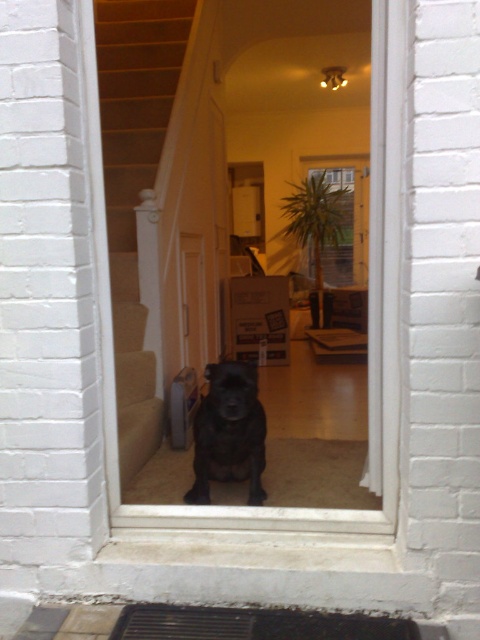
Looking at this image, you are standing outside the house looking through the slightly open doorway. You see the carpeted stairs at center and the shiny black dog at center. Which object is closer to you from your current position?

The shiny black dog at center is closer to you because the carpeted stairs at center is positioned over it, meaning the dog is beneath the stairs in the depth of the room.

You are a delivery person holding a 1.2 meter long package. You need to go through the doorway into the house to deliver it. The package must be carried horizontally. Is there enough space between the shiny black dog at center and the carpeted stairs at center to maneuver the package without hitting either?

The distance between the shiny black dog at center and the carpeted stairs at center is 82.07 centimeters. Since the package is 1.2 meters long, which is longer than the available space, you cannot maneuver the package horizontally between them without hitting either object.

You are a delivery person entering the house through the doorway. You see the dark brown textured mat at lower center and the shiny black dog at center. Which object is located closer to the entrance?

The dark brown textured mat at lower center is positioned under the shiny black dog at center, meaning the mat is closer to the entrance than the dog.